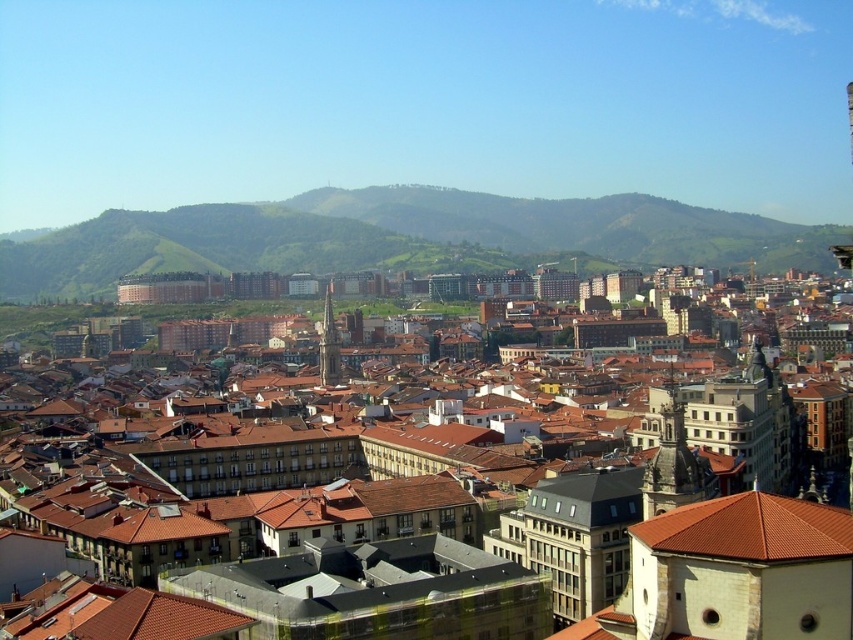
Question: Is brown tiled roofs at center to the left of smooth gray stone tower at center from the viewer's perspective?

Choices:
 (A) yes
 (B) no

Answer: (B)

Question: Does brown tiled roofs at center come behind smooth gray stone tower at center?

Choices:
 (A) no
 (B) yes

Answer: (A)

Question: Based on their relative distances, which object is nearer to the smooth gray stone tower at center?

Choices:
 (A) green grassy hill at center
 (B) brown tile roof at center

Answer: (A)

Question: Which of these objects is positioned closest to the green grassy hill at center?

Choices:
 (A) brown tile roof at center
 (B) brown tiled roofs at center
 (C) smooth gray stone tower at center

Answer: (C)

Question: Which object appears farthest from the camera in this image?

Choices:
 (A) brown tile roof at center
 (B) smooth gray stone tower at center
 (C) green grassy hill at center
 (D) brown tiled roofs at center

Answer: (C)

Question: Is brown tiled roofs at center bigger than smooth stone tower at center right?

Choices:
 (A) yes
 (B) no

Answer: (A)